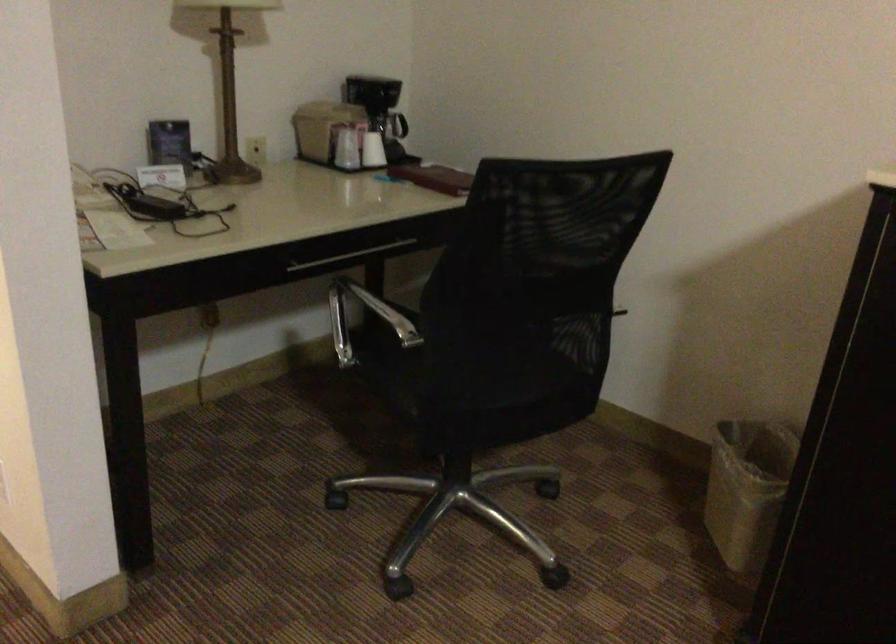
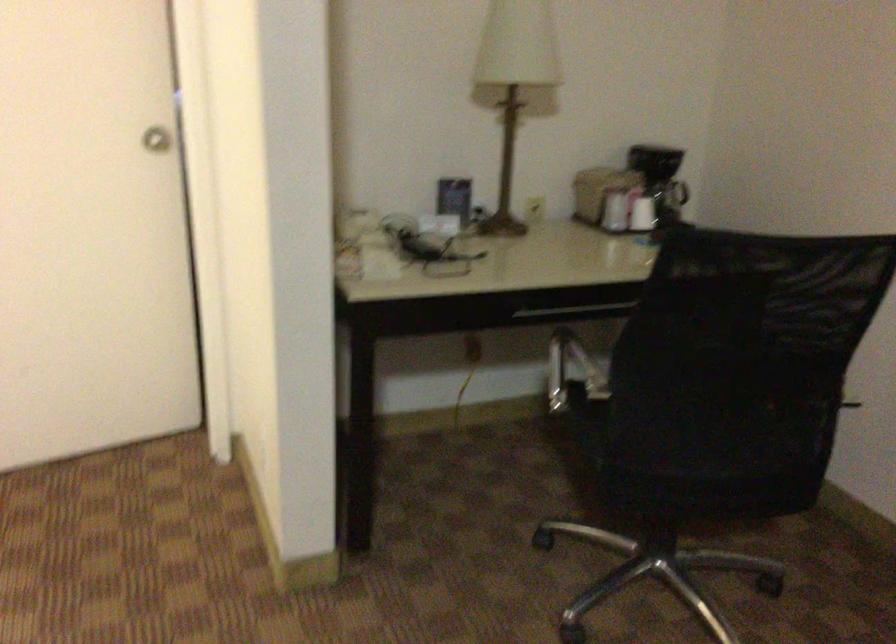
Where in the second image is the point corresponding to (x=326, y=131) from the first image?

(598, 192)